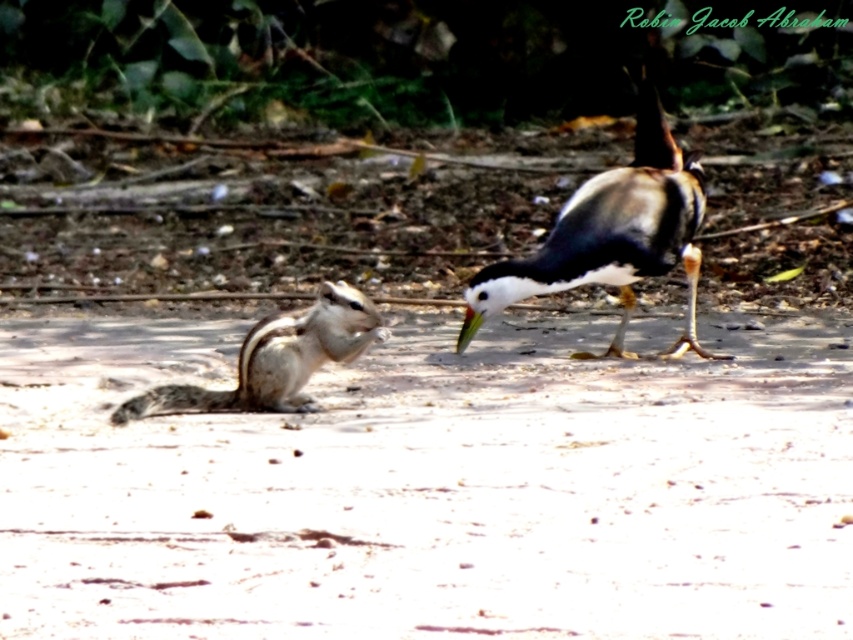
You are a photographer trying to capture a photo of the brown sandy dirt at center and the white and brown feathers at right. Which object should you focus on first if you want to ensure both are in focus, considering their positions relative to the camera?

The brown sandy dirt at center is located below the white and brown feathers at right, so you should focus on the white and brown feathers at right first since it is closer to the camera.